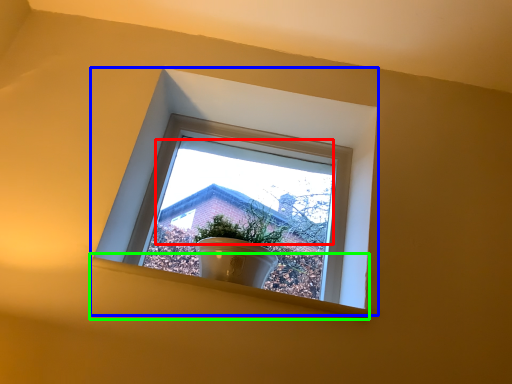
Question: Estimate the real-world distances between objects in this image. Which object is farther from morning light (highlighted by a red box), window (highlighted by a blue box) or window sill (highlighted by a green box)?

Choices:
 (A) window
 (B) window sill

Answer: (B)